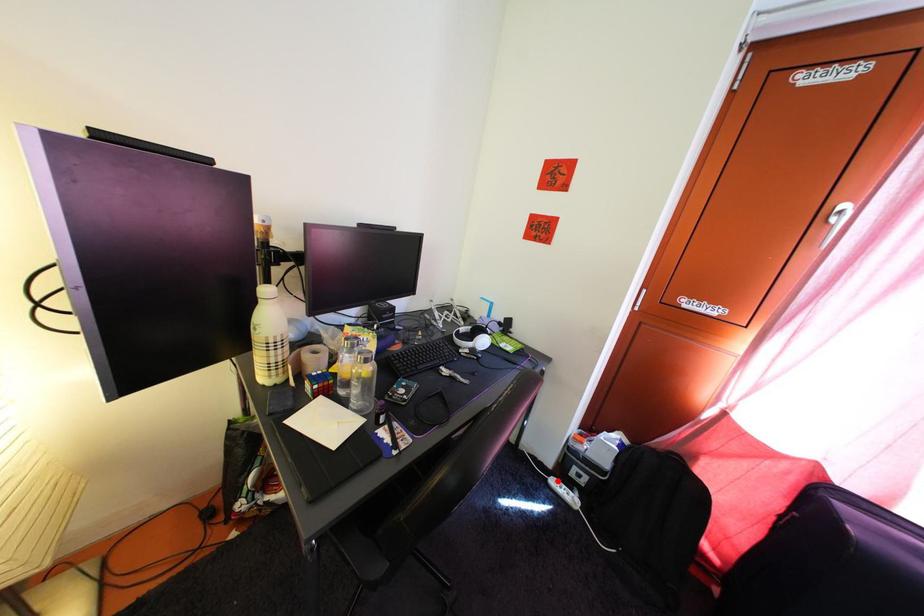
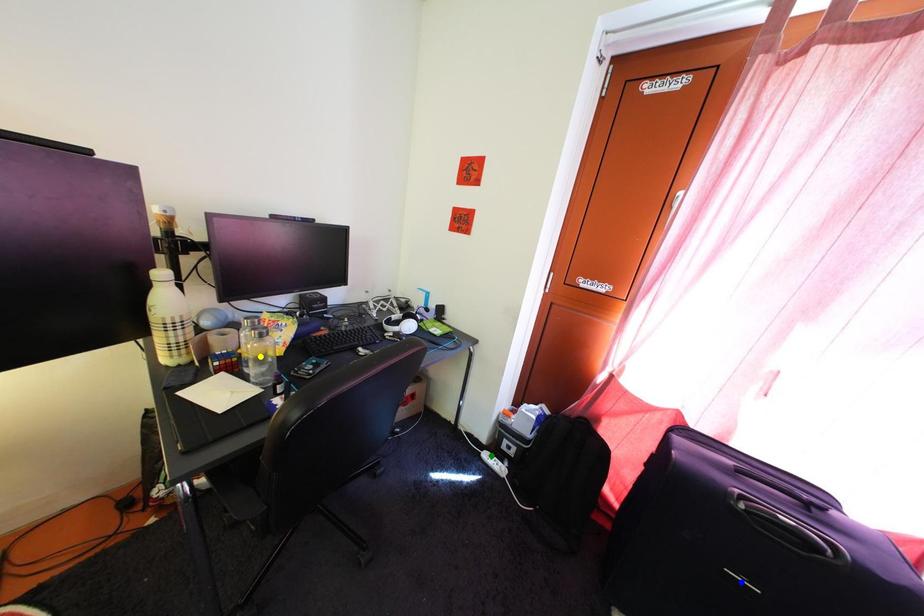
Question: I am providing you with two images of the same scene from different viewpoints. A red point is marked on the first image. You are given multiple points on the second image. Which spot in image 2 lines up with the point in image 1?

Choices:
 (A) blue point
 (B) green point
 (C) yellow point

Answer: (B)